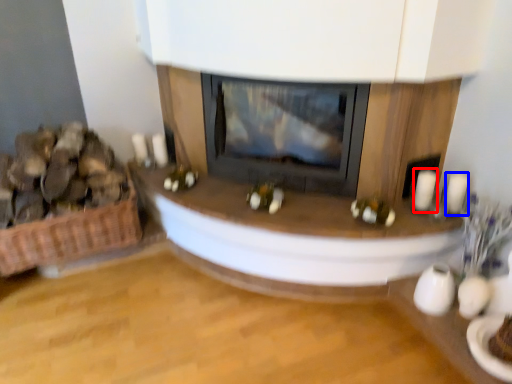
Question: Which object is further to the camera taking this photo, candle (highlighted by a red box) or candle (highlighted by a blue box)?

Choices:
 (A) candle
 (B) candle

Answer: (A)